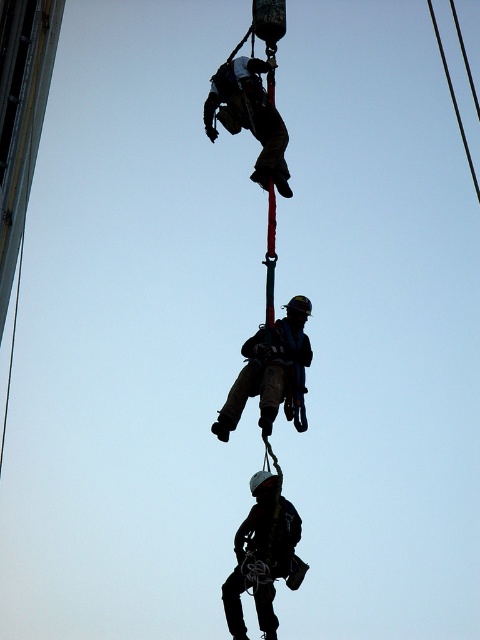
Question: Is black matte helmet at center further to camera compared to matte black harness at upper center?

Choices:
 (A) yes
 (B) no

Answer: (B)

Question: Which object appears closest to the camera in this image?

Choices:
 (A) matte black helmet at center
 (B) matte black harness at upper center
 (C) black matte helmet at center

Answer: (A)

Question: In this image, where is matte black helmet at center located relative to black wire at upper right?

Choices:
 (A) above
 (B) below

Answer: (B)

Question: Considering the relative positions of black matte helmet at center and matte black harness at upper center in the image provided, where is black matte helmet at center located with respect to matte black harness at upper center?

Choices:
 (A) right
 (B) left

Answer: (A)

Question: Which point is closer to the camera?

Choices:
 (A) (266, 180)
 (B) (235, 408)
 (C) (479, 200)

Answer: (B)

Question: Which point is farther from the camera taking this photo?

Choices:
 (A) (262, 481)
 (B) (275, 324)
 (C) (435, 36)

Answer: (C)